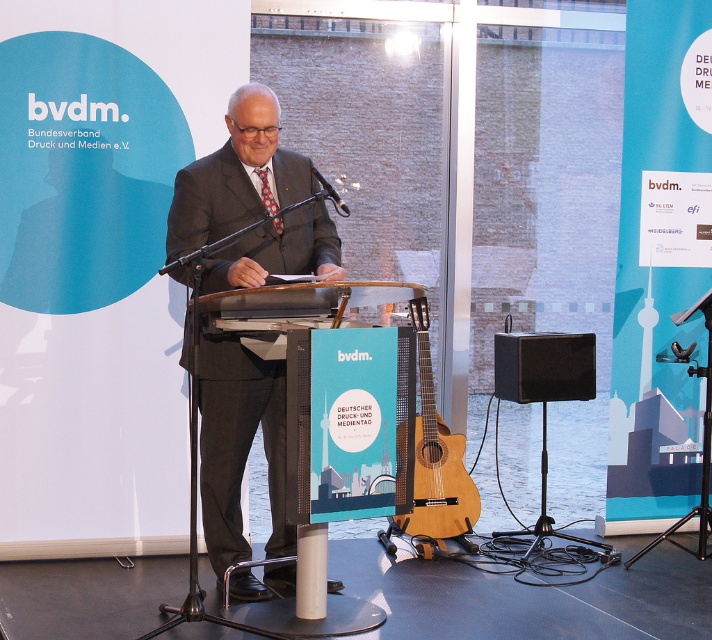
You are a GUI agent. You are given a task and a screenshot of the screen. Output one action in this format:
    pyautogui.click(x=<x>, y=<y>)
    Task: Click on the black matte speaker at right
    This screenshot has height=640, width=712.
    Given the screenshot: What is the action you would take?
    543,365

Between point (507, 396) and point (276, 227), which one is positioned in front?

Positioned in front is point (276, 227).

The width and height of the screenshot is (712, 640). Find the location of `black matte speaker at right`. black matte speaker at right is located at coordinates (543, 365).

In the scene shown: Does black matte speaker at right come in front of metallic shiny microphone at center?

That is False.

Is black matte speaker at right wider than metallic shiny microphone at center?

Indeed, black matte speaker at right has a greater width compared to metallic shiny microphone at center.

Measure the distance between black matte speaker at right and camera.

A distance of 5.29 meters exists between black matte speaker at right and camera.

The image size is (712, 640). Find the location of `black matte speaker at right`. black matte speaker at right is located at coordinates (543, 365).

Does red silk tie at center have a lesser width compared to metallic shiny microphone at center?

Indeed, red silk tie at center has a lesser width compared to metallic shiny microphone at center.

How much distance is there between red silk tie at center and metallic shiny microphone at center?

red silk tie at center and metallic shiny microphone at center are 7.40 inches apart.

Which is behind, point (266, 195) or point (330, 195)?

Positioned behind is point (266, 195).

I want to click on red silk tie at center, so click(268, 196).